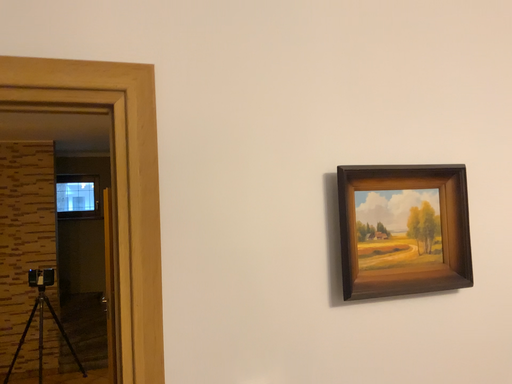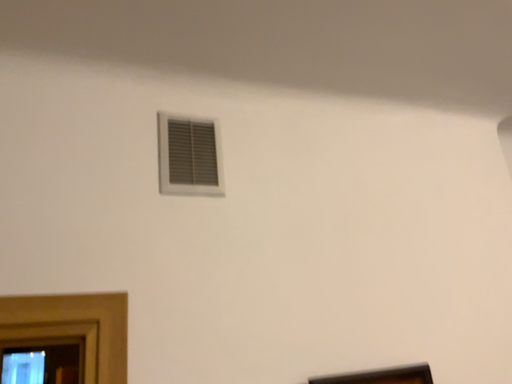
Question: How did the camera likely rotate when shooting the video?

Choices:
 (A) rotated downward
 (B) rotated upward

Answer: (B)